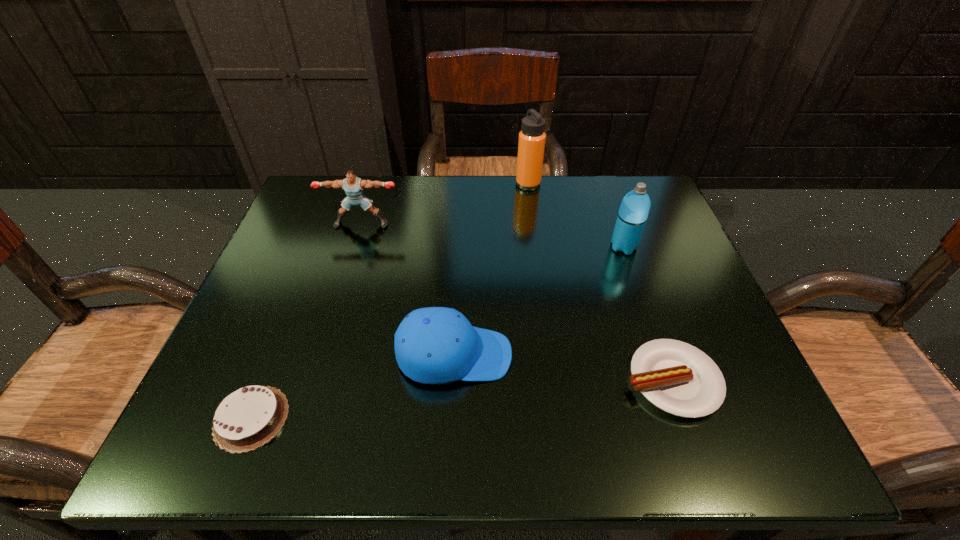
In the image, there is a desktop. Where is `vacant space at the right edge`? The height and width of the screenshot is (540, 960). vacant space at the right edge is located at coordinates (720, 327).

Image resolution: width=960 pixels, height=540 pixels. In the image, there is a desktop. What are the coordinates of `free space at the far left corner` in the screenshot? It's located at (300, 208).

The width and height of the screenshot is (960, 540). I want to click on free space at the far right corner of the desktop, so click(x=612, y=181).

This screenshot has height=540, width=960. I want to click on vacant space at the near right corner, so click(672, 440).

Where is `free spot between the fourth object from right to left and the sausage`? free spot between the fourth object from right to left and the sausage is located at coordinates (563, 368).

Locate an element on the screen. Image resolution: width=960 pixels, height=540 pixels. blank region between the farthest object and the cap is located at coordinates (492, 269).

This screenshot has height=540, width=960. In order to click on empty space that is in between the sausage and the fourth tallest object in this screenshot , I will do `click(563, 368)`.

Locate an element on the screen. Image resolution: width=960 pixels, height=540 pixels. unoccupied position between the shorter thermos bottle and the taller thermos bottle is located at coordinates (576, 215).

In order to click on free space between the fourth tallest object and the nearer thermos bottle in this screenshot , I will do `click(539, 301)`.

Image resolution: width=960 pixels, height=540 pixels. What are the coordinates of `blank region between the left thermos bottle and the third tallest object` in the screenshot? It's located at (444, 204).